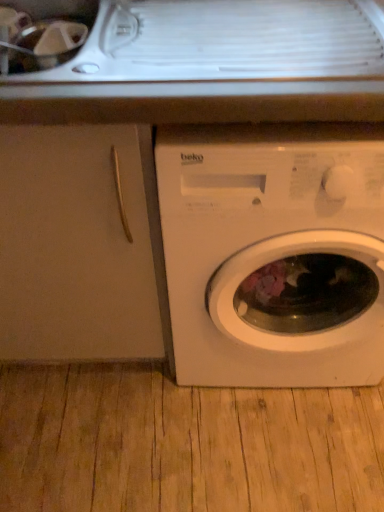
Question: Looking at the image, does matte white cabinet at left seem bigger or smaller compared to white matte washing machine at lower right?

Choices:
 (A) big
 (B) small

Answer: (A)

Question: Is matte white cabinet at left spatially inside white matte washing machine at lower right, or outside of it?

Choices:
 (A) outside
 (B) inside

Answer: (A)

Question: Considering the positions of point (92, 251) and point (183, 125), is point (92, 251) closer or farther from the camera than point (183, 125)?

Choices:
 (A) farther
 (B) closer

Answer: (A)

Question: Visually, is white matte washing machine at lower right positioned to the left or to the right of matte white cabinet at left?

Choices:
 (A) right
 (B) left

Answer: (A)

Question: Considering the positions of point (208, 155) and point (82, 295), is point (208, 155) closer or farther from the camera than point (82, 295)?

Choices:
 (A) farther
 (B) closer

Answer: (B)

Question: From a real-world perspective, is white matte washing machine at lower right physically located above or below matte white cabinet at left?

Choices:
 (A) above
 (B) below

Answer: (B)

Question: From the image's perspective, is white matte washing machine at lower right above or below matte white cabinet at left?

Choices:
 (A) below
 (B) above

Answer: (A)